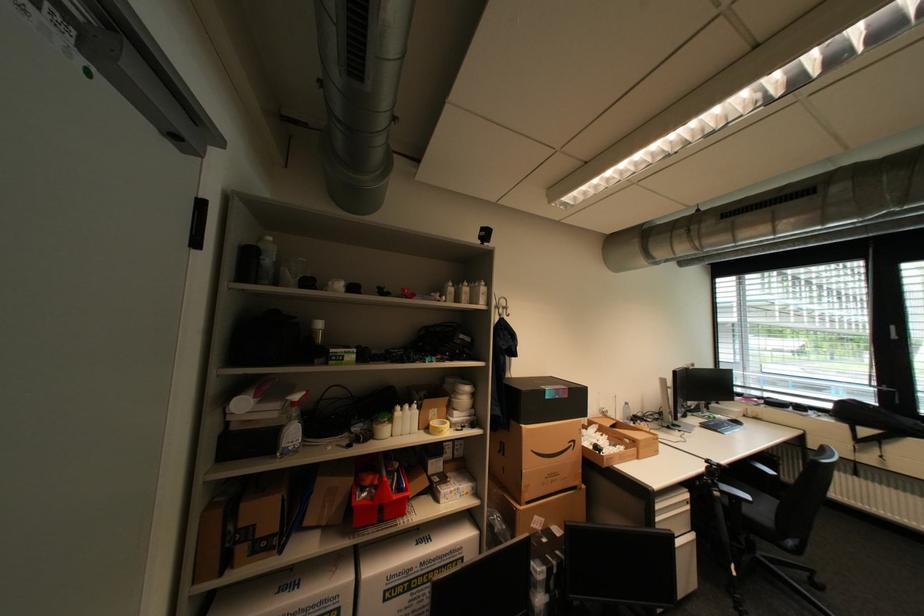
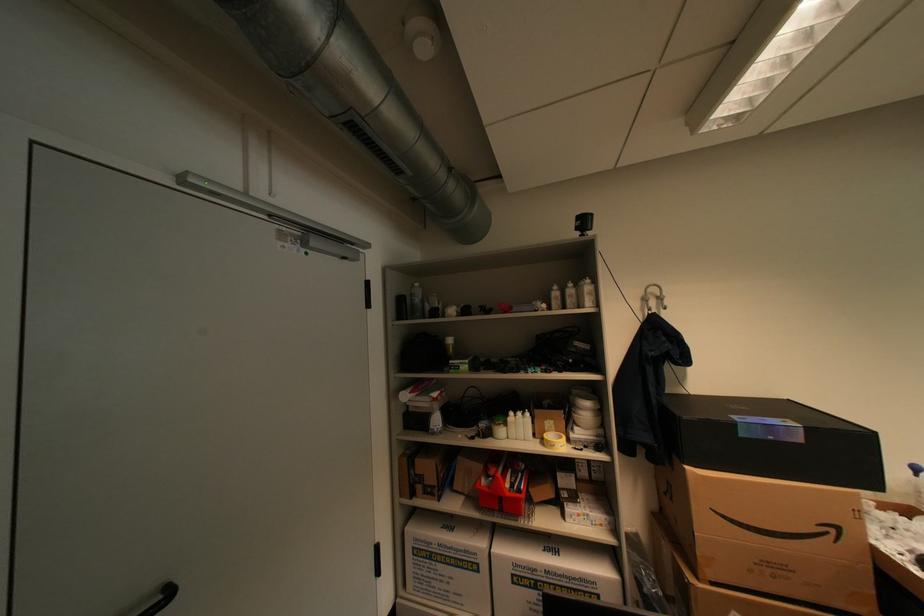
Locate, in the second image, the point that corresponds to the point at 431,431 in the first image.

(546, 440)